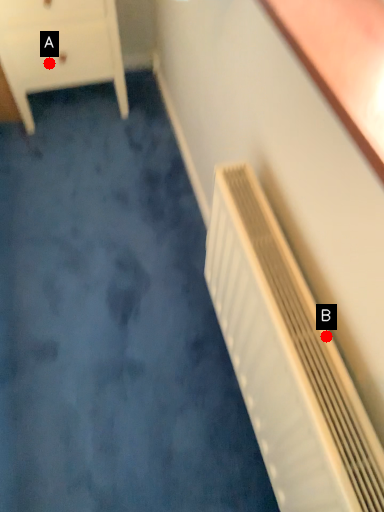
Question: Two points are circled on the image, labeled by A and B beside each circle. Which of the following is the closest to the observer?

Choices:
 (A) A is closer
 (B) B is closer

Answer: (B)